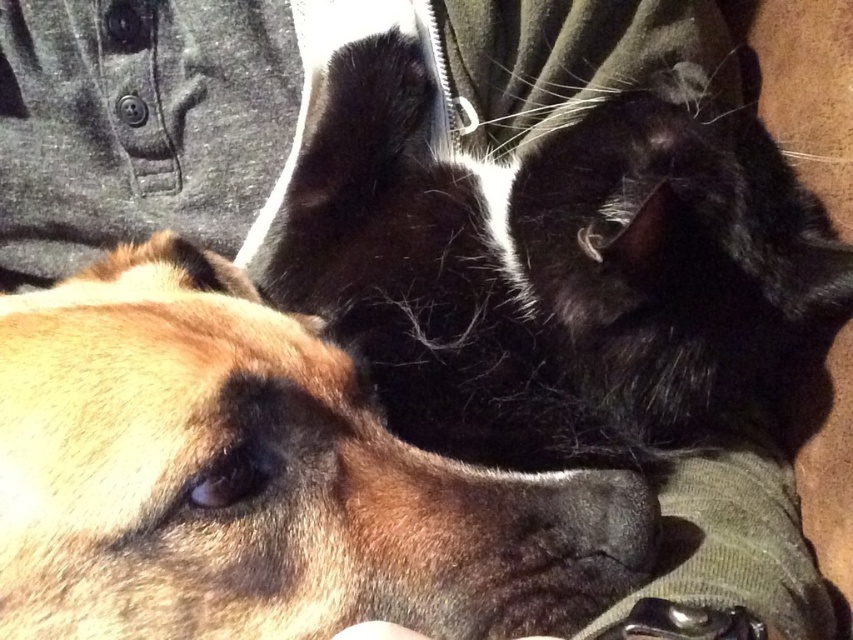
Is brown fur dog at center thinner than black silky fur cat at center?

Correct, brown fur dog at center's width is less than black silky fur cat at center's.

This screenshot has height=640, width=853. I want to click on brown fur dog at center, so click(260, 481).

Is brown fur dog at center taller than matte black nose at center?

Yes, brown fur dog at center is taller than matte black nose at center.

The height and width of the screenshot is (640, 853). I want to click on brown fur dog at center, so click(260, 481).

Who is more distant from viewer, [328,362] or [189,28]?

The point [189,28] is behind.

Locate an element on the screen. brown fur dog at center is located at coordinates (260, 481).

Between black silky fur cat at center and matte black nose at center, which one has more height?

black silky fur cat at center

Based on the photo, between black silky fur cat at center and matte black nose at center, which one appears on the left side from the viewer's perspective?

Positioned to the left is matte black nose at center.

Which is behind, point (625, 436) or point (196, 54)?

Point (196, 54)

You are a GUI agent. You are given a task and a screenshot of the screen. Output one action in this format:
    pyautogui.click(x=<x>, y=<y>)
    Task: Click on the black silky fur cat at center
    This screenshot has height=640, width=853.
    Given the screenshot: What is the action you would take?
    point(556,269)